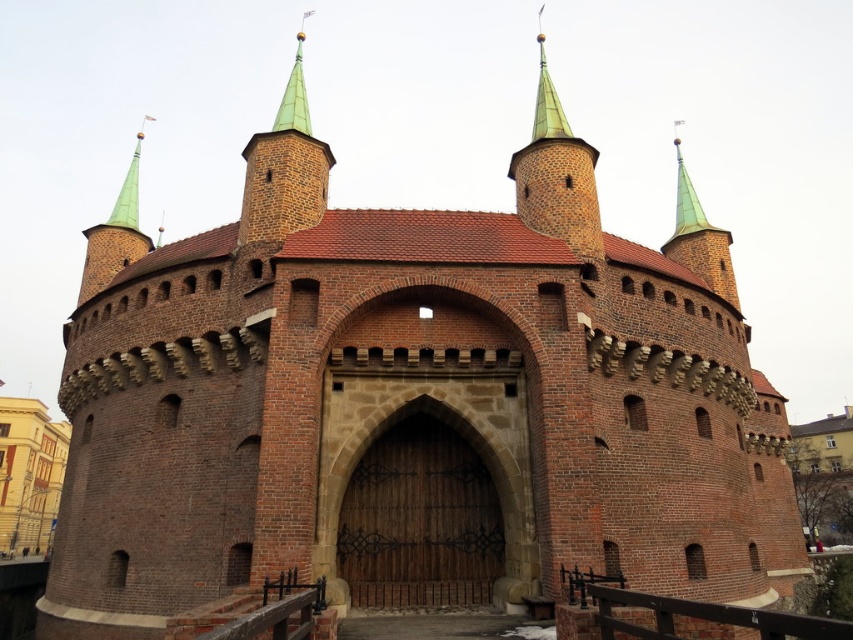
From the picture: Is black metal/rail at lower center taller than green pointed spire at upper center?

In fact, black metal/rail at lower center may be shorter than green pointed spire at upper center.

Identify the location of black metal/rail at lower center. This screenshot has height=640, width=853. (277, 611).

This screenshot has width=853, height=640. In order to click on black metal/rail at lower center in this screenshot , I will do `click(277, 611)`.